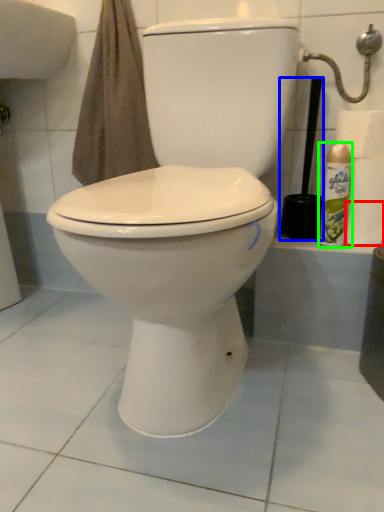
Question: Estimate the real-world distances between objects in this image. Which object is closer to toilet paper (highlighted by a red box), brush (highlighted by a blue box) or cleaning product (highlighted by a green box)?

Choices:
 (A) brush
 (B) cleaning product

Answer: (B)